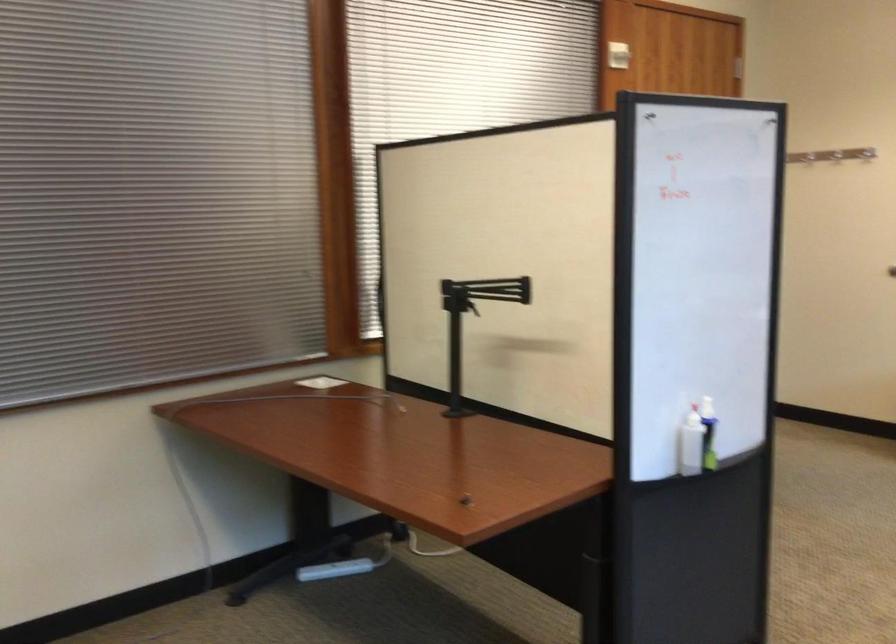
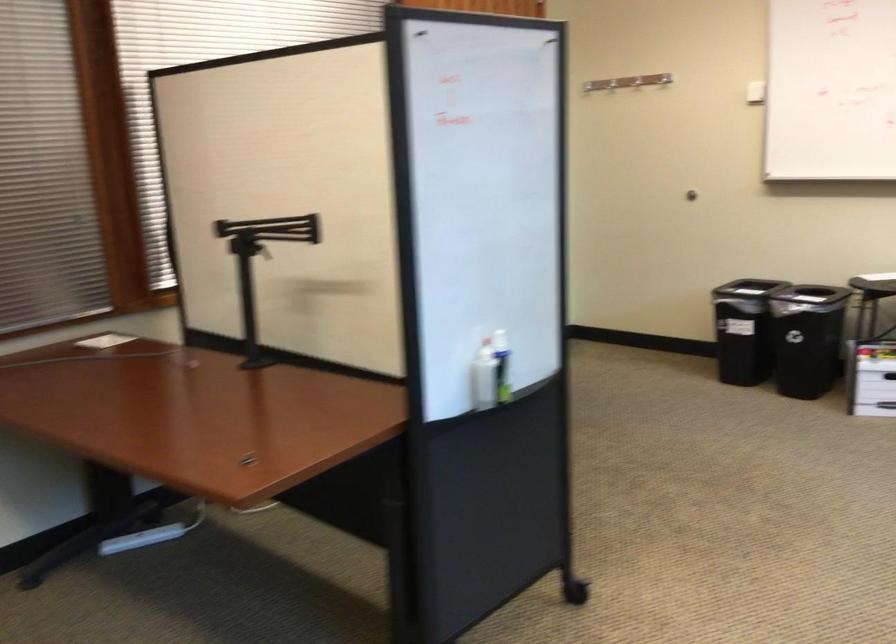
Question: The images are taken continuously from a first-person perspective. In which direction is your viewpoint rotating?

Choices:
 (A) Left
 (B) Right
 (C) Up
 (D) Down

Answer: (B)